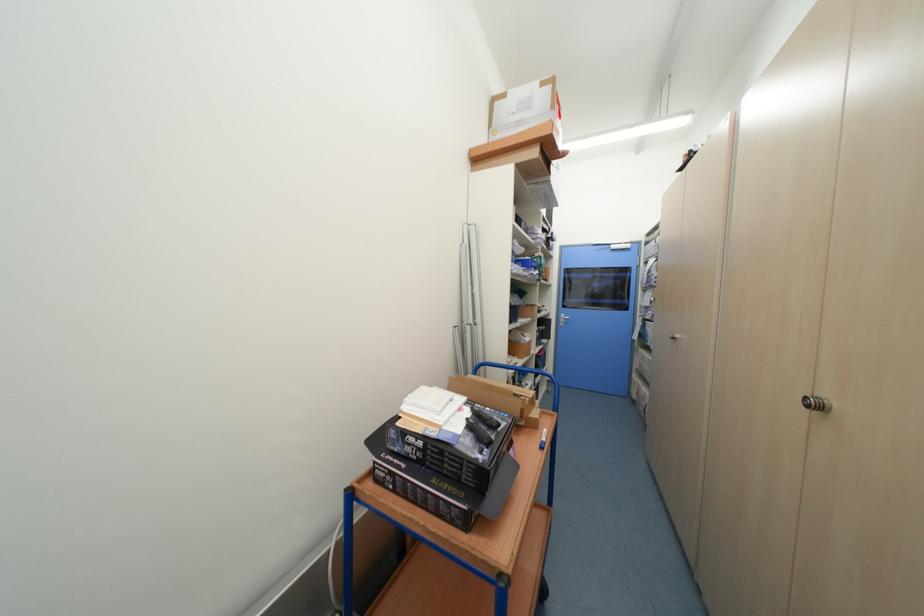
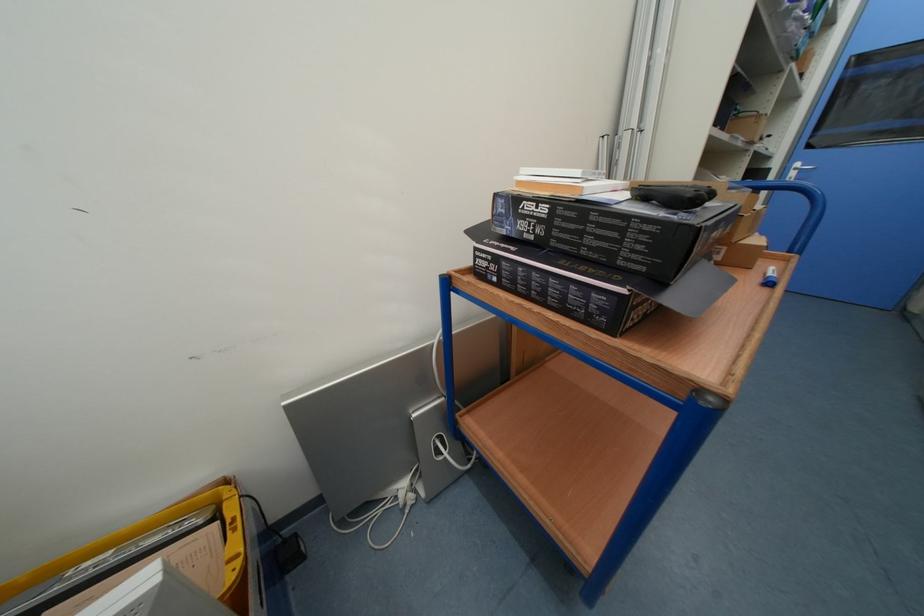
Locate, in the second image, the point that corresponds to point (569, 315) in the first image.

(804, 166)